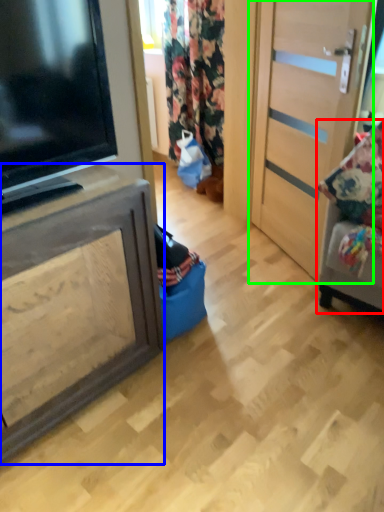
Question: Estimate the real-world distances between objects in this image. Which object is farther from furniture (highlighted by a red box), cabinetry (highlighted by a blue box) or door (highlighted by a green box)?

Choices:
 (A) cabinetry
 (B) door

Answer: (A)